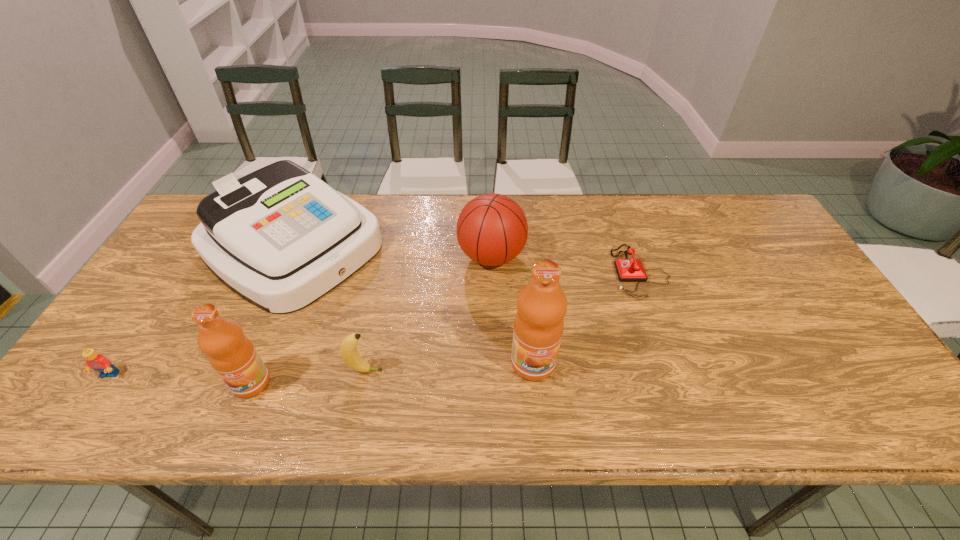
Locate an element on the screen. Image resolution: width=960 pixels, height=540 pixels. vacant region between the tallest object and the telephone is located at coordinates pos(587,318).

This screenshot has width=960, height=540. Find the location of `free space between the Lego and the basketball`. free space between the Lego and the basketball is located at coordinates (300, 316).

Locate an element on the screen. free spot between the telephone and the cash register is located at coordinates pos(467,260).

Identify the location of vacant area that lies between the basketball and the shorter fruit juice. The image size is (960, 540). (372, 320).

Where is `vacant area that lies between the cash register and the shorter fruit juice`? The width and height of the screenshot is (960, 540). vacant area that lies between the cash register and the shorter fruit juice is located at coordinates (273, 315).

Find the location of `empty space between the cash register and the fifth tallest object`. empty space between the cash register and the fifth tallest object is located at coordinates (329, 309).

Find the location of a particular element. This screenshot has height=540, width=960. blank region between the banana and the tallest object is located at coordinates 449,367.

This screenshot has height=540, width=960. What are the coordinates of `unoccupied area between the second shortest object and the basketball` in the screenshot? It's located at (300, 316).

You are a GUI agent. You are given a task and a screenshot of the screen. Output one action in this format:
    pyautogui.click(x=<x>, y=<y>)
    Task: Click on the object that is the fifth closest to the rightmost object
    Image resolution: width=960 pixels, height=540 pixels.
    Given the screenshot: What is the action you would take?
    pyautogui.click(x=233, y=356)

I want to click on object identified as the third closest to the basketball, so click(x=628, y=270).